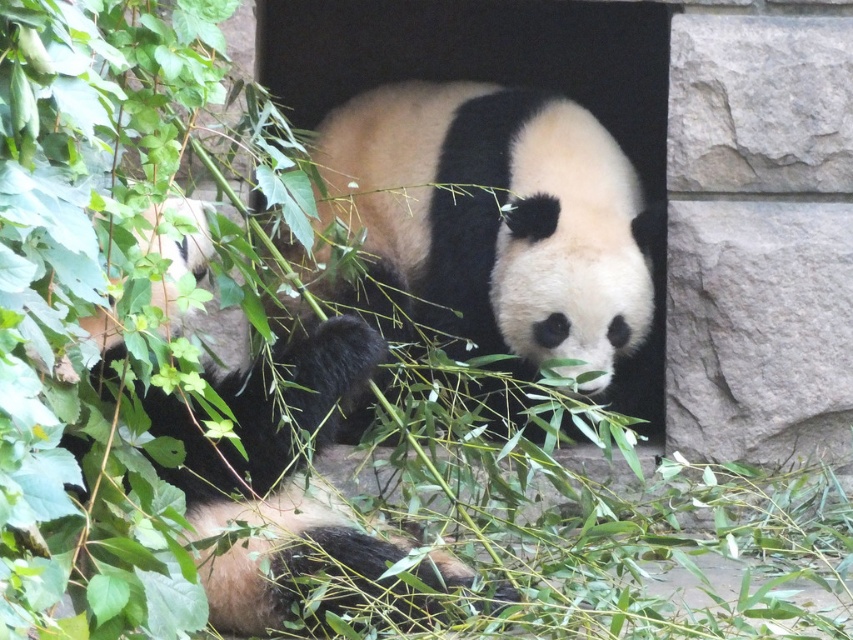
You are a zookeeper trying to identify the pandas in the enclosure. Which panda is bigger between the black fuzzy panda at center and the black and white fur panda at center?

The black fuzzy panda at center is larger in size than the black and white fur panda at center.

You are a zookeeper standing at the entrance of the enclosure. You need to locate the black fuzzy panda at center. According to the coordinates provided, where should you look to find it?

The black fuzzy panda at center is located at coordinates point (x=491, y=224).

You are a zookeeper observing two pandas in the enclosure. You notice the black fuzzy panda at center and the black and white fur panda at center. Which panda is positioned to the right of the other?

The black fuzzy panda at center is to the right of the black and white fur panda at center.